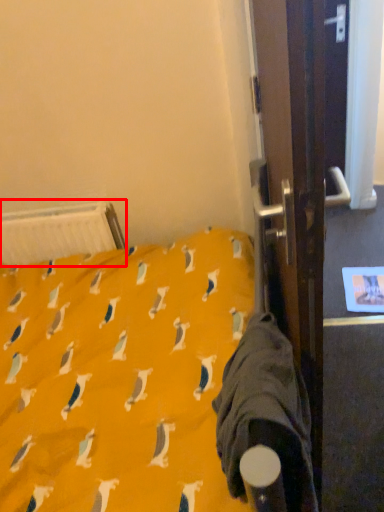
Question: From the image's perspective, considering the relative positions of radiator (annotated by the red box) and sleeping bag in the image provided, where is radiator (annotated by the red box) located with respect to the staircase?

Choices:
 (A) above
 (B) below

Answer: (A)